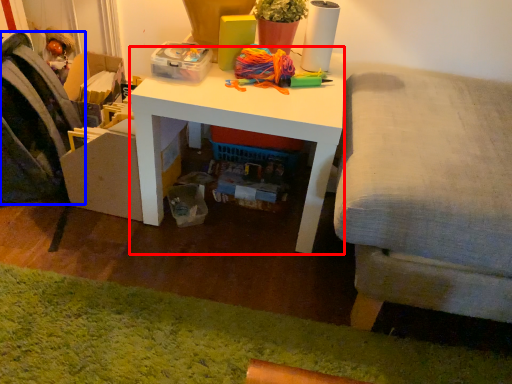
Question: Which object appears farthest to the camera in this image, desk (highlighted by a red box) or swivel chair (highlighted by a blue box)?

Choices:
 (A) desk
 (B) swivel chair

Answer: (B)